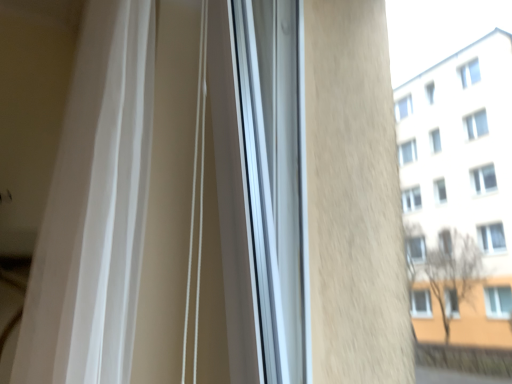
The image size is (512, 384). Describe the element at coordinates (95, 208) in the screenshot. I see `white sheer curtain at left` at that location.

Locate an element on the screen. white sheer curtain at left is located at coordinates (95, 208).

Locate an element on the screen. The height and width of the screenshot is (384, 512). white sheer curtain at left is located at coordinates (95, 208).